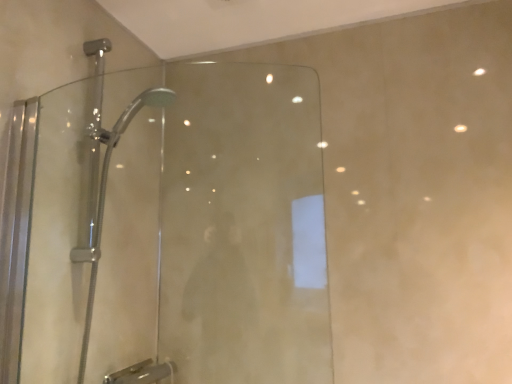
Question: Should I look upward or downward to see transparent glass shower door at center?

Choices:
 (A) up
 (B) down

Answer: (B)